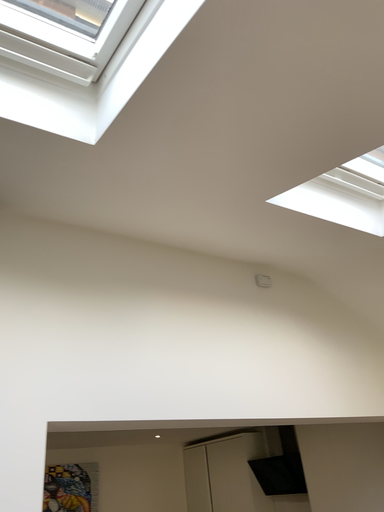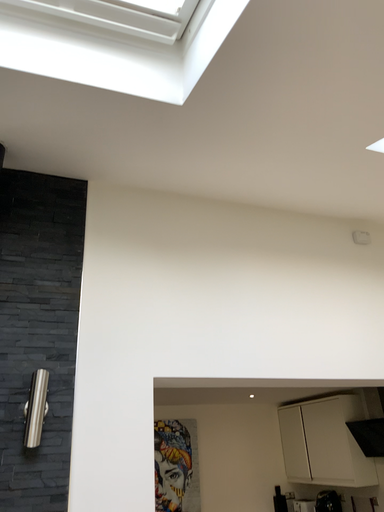
Question: Which way did the camera rotate in the video?

Choices:
 (A) rotated left
 (B) rotated right

Answer: (A)